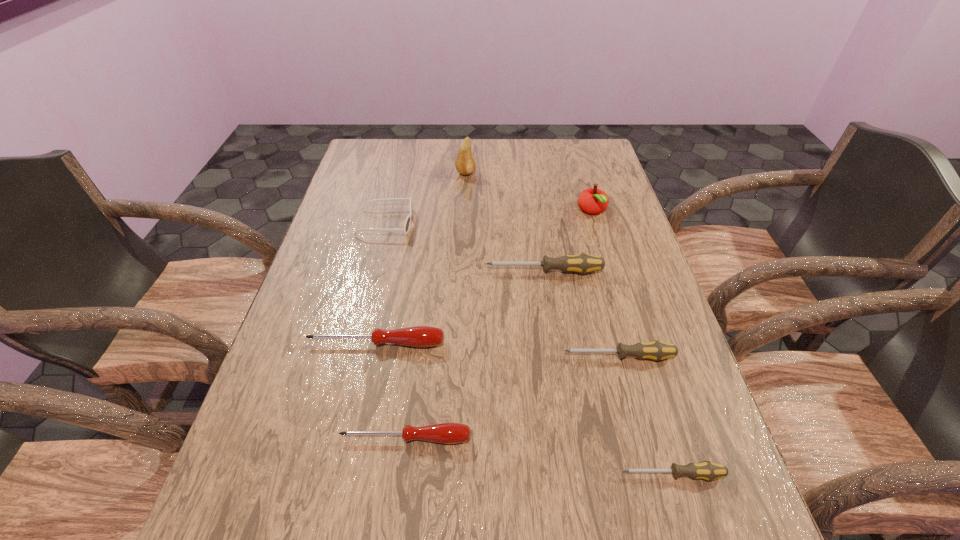
At what (x,y) coordinates should I click in order to perform the action: click on vacant point located at the tip of the second nearest gray screwdriver. Please return your answer as a coordinate pair (x, y). Looking at the image, I should click on (483, 356).

At what (x,y) coordinates should I click in order to perform the action: click on free spot located at the tip of the second nearest gray screwdriver. Please return your answer as a coordinate pair (x, y). Image resolution: width=960 pixels, height=540 pixels. Looking at the image, I should click on (539, 356).

The image size is (960, 540). I want to click on free space located 0.320m at the tip of the second nearest gray screwdriver, so click(x=413, y=356).

This screenshot has height=540, width=960. Find the location of `free space located 0.310m on the back of the seventh farthest object`. free space located 0.310m on the back of the seventh farthest object is located at coordinates (422, 305).

Locate an element on the screen. free space located at the tip of the nearest object is located at coordinates (500, 475).

Locate an element on the screen. Image resolution: width=960 pixels, height=540 pixels. free space located at the tip of the nearest object is located at coordinates (454, 475).

Identify the location of vacant space situated at the tip of the nearest object. (592, 475).

At what (x,y) coordinates should I click in order to perform the action: click on object present at the far edge. Please return your answer as a coordinate pair (x, y). The width and height of the screenshot is (960, 540). Looking at the image, I should click on (465, 163).

Where is `sunglasses that is at the left edge`? The height and width of the screenshot is (540, 960). sunglasses that is at the left edge is located at coordinates (406, 228).

The width and height of the screenshot is (960, 540). Find the location of `screwdriver positioned at the left edge`. screwdriver positioned at the left edge is located at coordinates (418, 336).